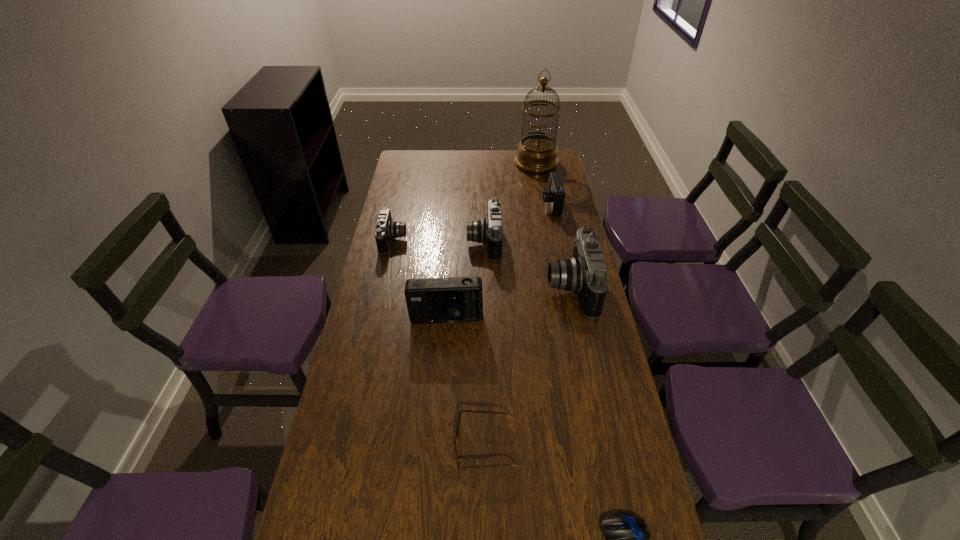
The image size is (960, 540). Identify the location of birdcage positioned at the right edge. (537, 153).

This screenshot has width=960, height=540. Identify the location of object located at the far right corner. (537, 153).

Find the location of a particular element. This screenshot has height=540, width=960. vacant space at the far edge of the desktop is located at coordinates (514, 152).

At what (x,y) coordinates should I click in order to perform the action: click on vacant area at the left edge of the desktop. Please return your answer as a coordinate pair (x, y). This screenshot has height=540, width=960. Looking at the image, I should click on (386, 368).

In the image, there is a desktop. Where is `vacant area at the right edge`? This screenshot has width=960, height=540. vacant area at the right edge is located at coordinates (546, 216).

What are the coordinates of `free spot at the far left corner of the desktop` in the screenshot? It's located at coord(417,172).

Identify the location of unoccupied position between the sunglasses and the seventh nearest object. The height and width of the screenshot is (540, 960). (518, 326).

Where is `free space between the second biggest black camera and the farther blue camera`? Image resolution: width=960 pixels, height=540 pixels. free space between the second biggest black camera and the farther blue camera is located at coordinates (517, 224).

You are a GUI agent. You are given a task and a screenshot of the screen. Output one action in this format:
    pyautogui.click(x=<x>, y=<y>)
    Task: Click on the vacant area between the farther blue camera and the second black camera from left to right
    
    Given the screenshot: What is the action you would take?
    pyautogui.click(x=517, y=224)

Where is `vacant region between the farther blue camera and the biggest black camera`? This screenshot has width=960, height=540. vacant region between the farther blue camera and the biggest black camera is located at coordinates (561, 247).